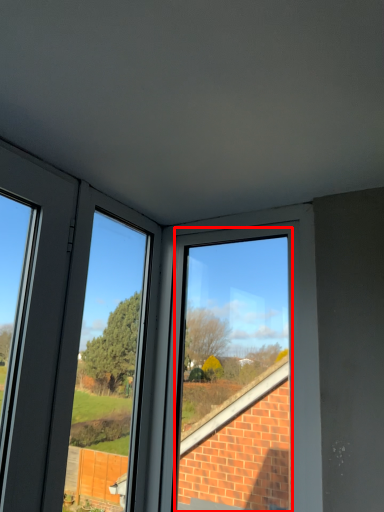
Question: From the image's perspective, where is bay window (annotated by the red box) located in relation to window frame in the image?

Choices:
 (A) below
 (B) above

Answer: (A)